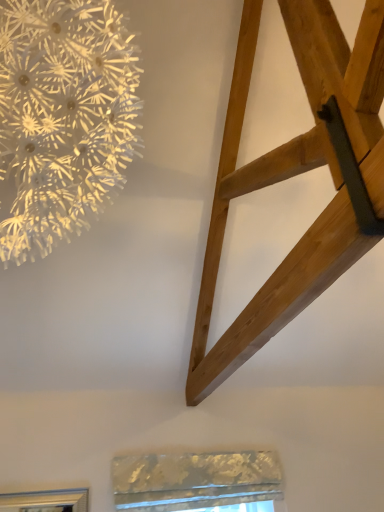
The width and height of the screenshot is (384, 512). I want to click on white textured paper flower at upper left, so click(63, 117).

This screenshot has height=512, width=384. I want to click on metallic textured window at lower center, so click(x=197, y=482).

Where is `white textured paper flower at upper left`? This screenshot has height=512, width=384. white textured paper flower at upper left is located at coordinates (63, 117).

Based on the photo, is natural wood ladder at upper right wider than white textured paper flower at upper left?

Correct, the width of natural wood ladder at upper right exceeds that of white textured paper flower at upper left.

From their relative heights in the image, would you say natural wood ladder at upper right is taller or shorter than white textured paper flower at upper left?

In the image, natural wood ladder at upper right appears to be shorter than white textured paper flower at upper left.

From the image's perspective, is natural wood ladder at upper right above or below white textured paper flower at upper left?

From the image's perspective, natural wood ladder at upper right appears below white textured paper flower at upper left.

Who is bigger, natural wood ladder at upper right or white textured paper flower at upper left?

Bigger between the two is white textured paper flower at upper left.

From the image's perspective, is white textured paper flower at upper left on top of metallic textured window at lower center?

Indeed, from the image's perspective, white textured paper flower at upper left is shown above metallic textured window at lower center.

Does white textured paper flower at upper left appear on the left side of metallic textured window at lower center?

Indeed, white textured paper flower at upper left is positioned on the left side of metallic textured window at lower center.

Between point (76, 132) and point (164, 481), which one is positioned in front?

The point (76, 132) is in front.

From a real-world perspective, is white textured paper flower at upper left above or below metallic textured window at lower center?

From a real-world perspective, white textured paper flower at upper left is physically above metallic textured window at lower center.

Consider the image. Is white textured paper flower at upper left far away from natural wood ladder at upper right?

No.

Is white textured paper flower at upper left not inside natural wood ladder at upper right?

white textured paper flower at upper left lies outside natural wood ladder at upper right's area.

Is white textured paper flower at upper left facing towards natural wood ladder at upper right?

No, white textured paper flower at upper left does not turn towards natural wood ladder at upper right.

In terms of width, does metallic textured window at lower center look wider or thinner when compared to white textured paper flower at upper left?

Clearly, metallic textured window at lower center has less width compared to white textured paper flower at upper left.

Does metallic textured window at lower center come behind white textured paper flower at upper left?

Yes, metallic textured window at lower center is behind white textured paper flower at upper left.

From a real-world perspective, which object stands above the other?

white textured paper flower at upper left, from a real-world perspective.

Considering the positions of points (245, 460) and (254, 172), is point (245, 460) farther from camera compared to point (254, 172)?

Yes, point (245, 460) is behind point (254, 172).

Can you confirm if metallic textured window at lower center is smaller than natural wood ladder at upper right?

Correct, metallic textured window at lower center occupies less space than natural wood ladder at upper right.

In the image, is metallic textured window at lower center on the left side or the right side of natural wood ladder at upper right?

In the image, metallic textured window at lower center appears on the left side of natural wood ladder at upper right.

Looking at this image, is natural wood ladder at upper right not close to metallic textured window at lower center?

Yes, natural wood ladder at upper right and metallic textured window at lower center are located far from each other.

Is natural wood ladder at upper right facing towards metallic textured window at lower center?

No, natural wood ladder at upper right does not turn towards metallic textured window at lower center.

Which is in front, point (297, 143) or point (236, 488)?

Point (297, 143)

Locate an element on the screen. Image resolution: width=384 pixels, height=512 pixels. furniture above the white textured paper flower at upper left (from a real-world perspective) is located at coordinates (294, 175).

Find the location of a particular element. This screenshot has height=512, width=384. window located behind the white textured paper flower at upper left is located at coordinates (197, 482).

Estimate the real-world distances between objects in this image. Which object is closer to white textured paper flower at upper left, natural wood ladder at upper right or metallic textured window at lower center?

The object closer to white textured paper flower at upper left is natural wood ladder at upper right.

From the image, which object appears to be farther from metallic textured window at lower center, white textured paper flower at upper left or natural wood ladder at upper right?

The object further to metallic textured window at lower center is white textured paper flower at upper left.

From the image, which object appears to be farther from natural wood ladder at upper right, white textured paper flower at upper left or metallic textured window at lower center?

The object further to natural wood ladder at upper right is metallic textured window at lower center.

Looking at the image, which one is located further to white textured paper flower at upper left, metallic textured window at lower center or natural wood ladder at upper right?

metallic textured window at lower center.

Which object lies further to the anchor point metallic textured window at lower center, natural wood ladder at upper right or white textured paper flower at upper left?

white textured paper flower at upper left.

Estimate the real-world distances between objects in this image. Which object is further from natural wood ladder at upper right, metallic textured window at lower center or white textured paper flower at upper left?

The object further to natural wood ladder at upper right is metallic textured window at lower center.

Locate an element on the screen. The image size is (384, 512). furniture that lies between white textured paper flower at upper left and metallic textured window at lower center from top to bottom is located at coordinates (294, 175).